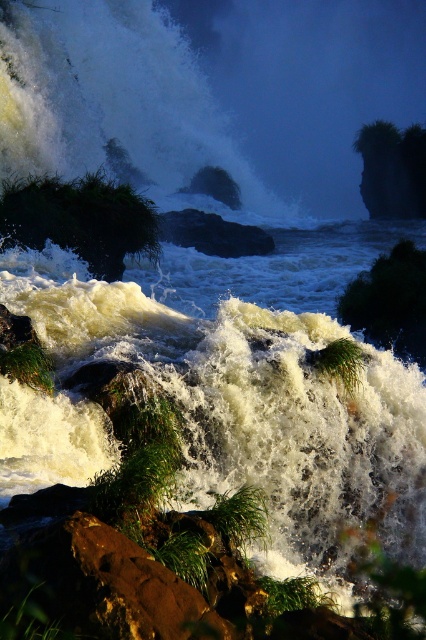
Between point (399, 278) and point (391, 152), which one is positioned behind?

Point (391, 152)

Does green leafy tree at lower right have a lesser height compared to green grassy rock at upper right?

Correct, green leafy tree at lower right is not as tall as green grassy rock at upper right.

Find the location of `green leafy tree at lower right`. green leafy tree at lower right is located at coordinates (391, 301).

You are a GUI agent. You are given a task and a screenshot of the screen. Output one action in this format:
    pyautogui.click(x=<x>, y=<y>)
    Task: Click on the green leafy tree at lower right
    
    Given the screenshot: What is the action you would take?
    pyautogui.click(x=391, y=301)

Is point (135, 13) behind point (71, 221)?

Yes.

Who is shorter, white frothy water at upper left or green grassy bush at left?

With less height is green grassy bush at left.

Which is in front, point (91, 28) or point (66, 218)?

Point (66, 218) is in front.

Find the location of a particular element. The width and height of the screenshot is (426, 640). white frothy water at upper left is located at coordinates (117, 100).

Between white frothy water at center and green leafy tree at lower right, which one appears on the right side from the viewer's perspective?

green leafy tree at lower right is more to the right.

Does white frothy water at center come behind green leafy tree at lower right?

No, it is not.

The image size is (426, 640). In order to click on white frothy water at center in this screenshot , I will do `click(258, 412)`.